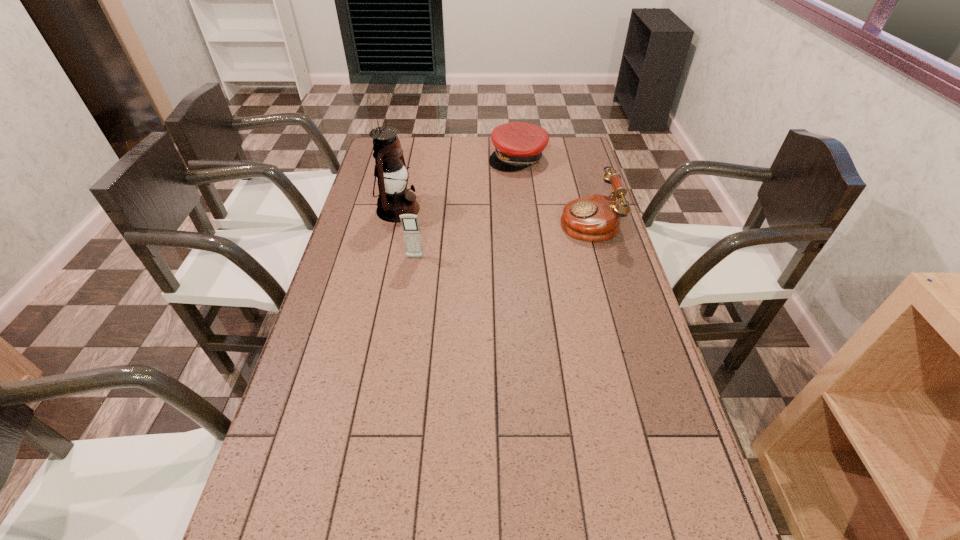
Image resolution: width=960 pixels, height=540 pixels. What are the coordinates of `the nearest object` in the screenshot? It's located at (410, 225).

The image size is (960, 540). Identify the location of telephone. (596, 217).

Locate an element on the screen. The width and height of the screenshot is (960, 540). cap is located at coordinates (518, 145).

The image size is (960, 540). Find the location of `the second object from right to left`. the second object from right to left is located at coordinates (518, 145).

In order to click on lantern in this screenshot , I will do `click(394, 199)`.

Locate an element on the screen. The height and width of the screenshot is (540, 960). vacant space located 0.070m on the front-facing side of the cellular telephone is located at coordinates (412, 275).

Where is `vacant space located on the dial of the telephone`? vacant space located on the dial of the telephone is located at coordinates (445, 220).

Find the location of a particular element. This screenshot has width=960, height=540. vacant space located 0.390m on the dial of the telephone is located at coordinates (448, 220).

Locate an element on the screen. This screenshot has height=540, width=960. vacant position located on the dial of the telephone is located at coordinates pos(508,220).

What are the coordinates of `vacant space located on the front-facing side of the farthest object` in the screenshot? It's located at (519, 228).